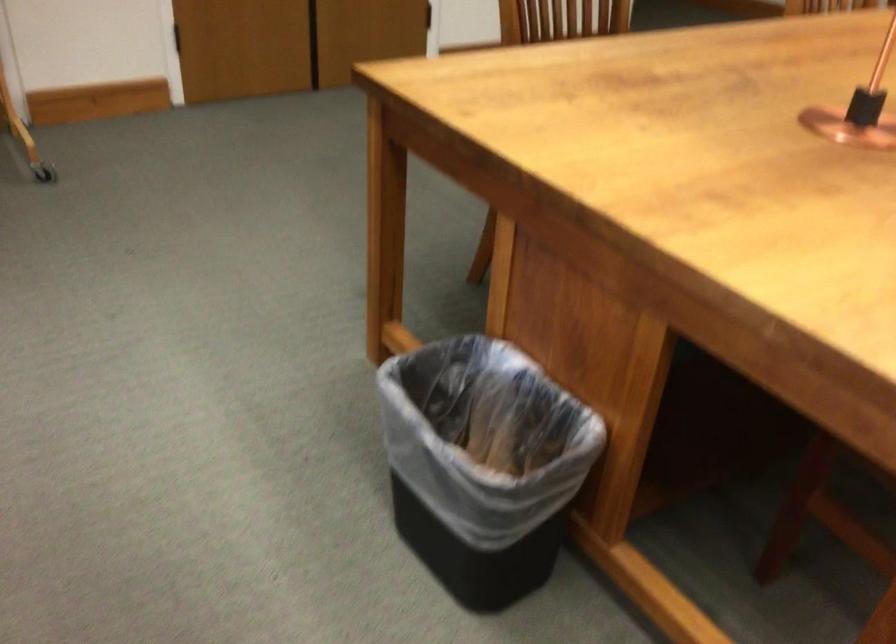
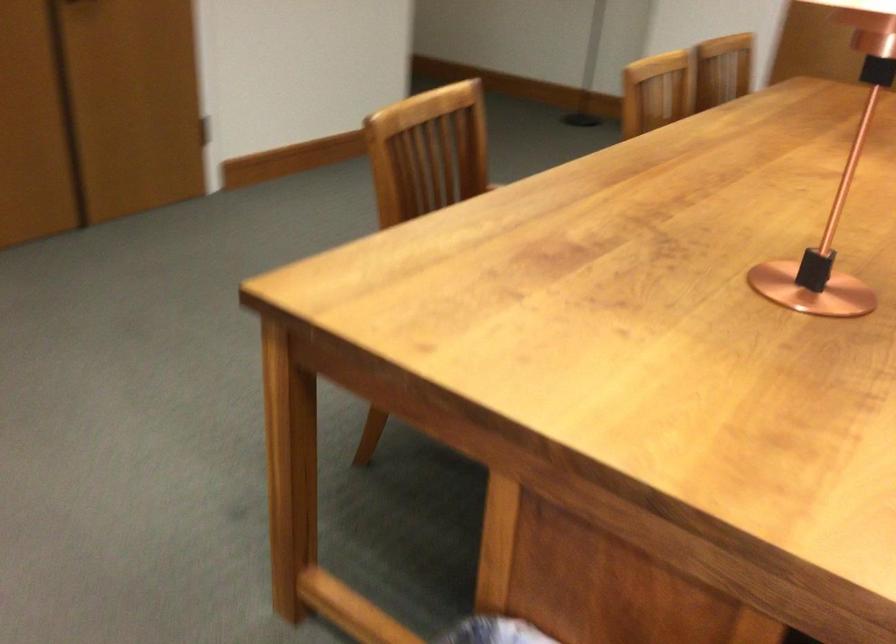
Question: The first image is from the beginning of the video and the second image is from the end. How did the camera likely rotate when shooting the video?

Choices:
 (A) Left
 (B) Right
 (C) Up
 (D) Down

Answer: (B)